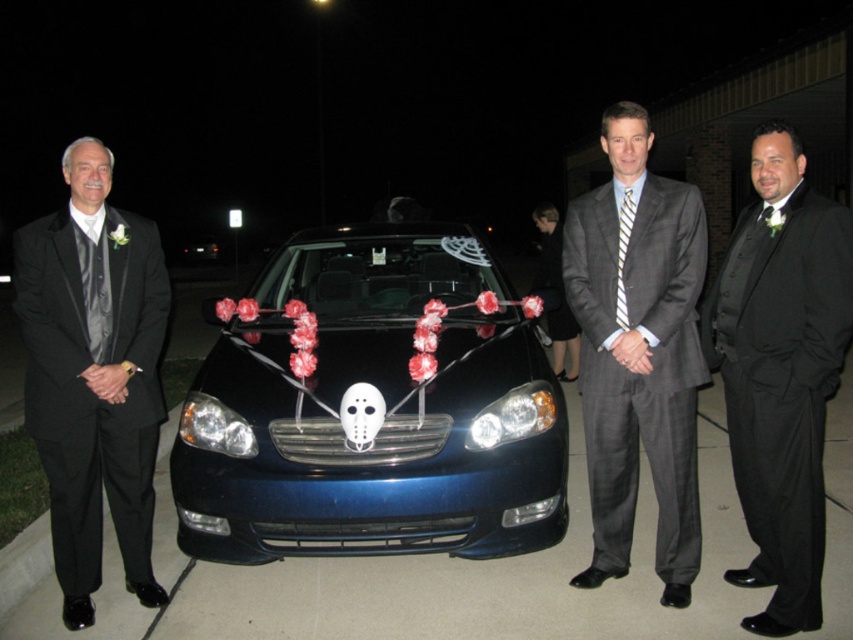
Question: Which of the following is the closest to the observer?

Choices:
 (A) black satin suit at left
 (B) metallic blue car at center

Answer: (A)

Question: Is black satin suit at left smaller than gray pinstripe suit at center?

Choices:
 (A) yes
 (B) no

Answer: (A)

Question: Which point is farther to the camera?

Choices:
 (A) metallic blue car at center
 (B) black satin suit at center
 (C) striped fabric tie at center
 (D) gray pinstripe suit at center

Answer: (A)

Question: Can you confirm if metallic blue car at center is positioned above gray pinstripe suit at center?

Choices:
 (A) no
 (B) yes

Answer: (B)

Question: Which of the following is the closest to the observer?

Choices:
 (A) black satin suit at left
 (B) striped fabric tie at center
 (C) gray pinstripe suit at center

Answer: (A)

Question: Is metallic blue car at center further to camera compared to black satin suit at left?

Choices:
 (A) no
 (B) yes

Answer: (B)